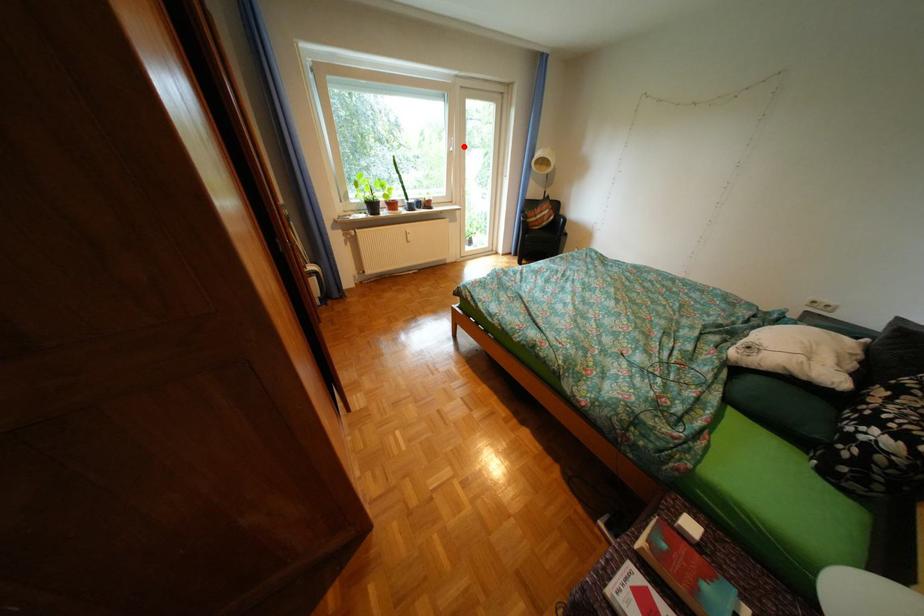
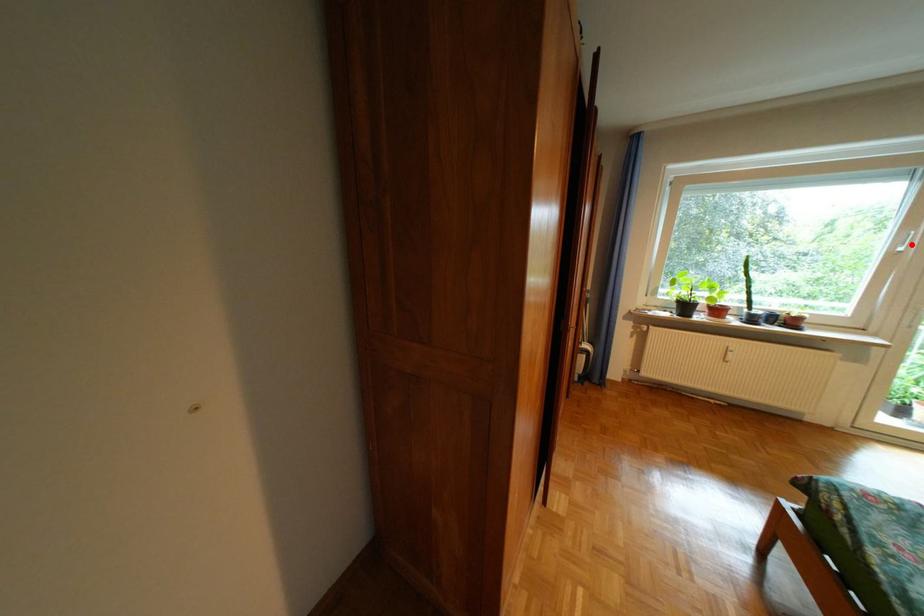
I am providing you with two images of the same scene from different viewpoints. A red point is marked on the first image and another point is marked on the second image. Is the red point in image1 aligned with the point shown in image2?

Yes